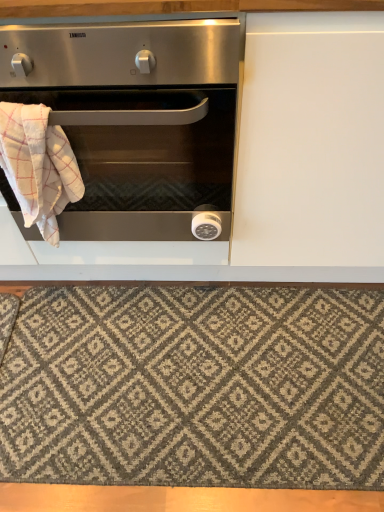
Question: Is textured gray rug at lower center thinner than white checkered towel at left?

Choices:
 (A) yes
 (B) no

Answer: (B)

Question: Is textured gray rug at lower center closer to camera compared to white checkered towel at left?

Choices:
 (A) no
 (B) yes

Answer: (A)

Question: Can we say textured gray rug at lower center lies outside white checkered towel at left?

Choices:
 (A) yes
 (B) no

Answer: (A)

Question: Can you confirm if textured gray rug at lower center is positioned to the right of white checkered towel at left?

Choices:
 (A) no
 (B) yes

Answer: (B)

Question: From a real-world perspective, is textured gray rug at lower center positioned over white checkered towel at left based on gravity?

Choices:
 (A) yes
 (B) no

Answer: (B)

Question: Considering the positions of white checkered towel at left and stainless steel oven at left in the image, is white checkered towel at left bigger or smaller than stainless steel oven at left?

Choices:
 (A) small
 (B) big

Answer: (A)

Question: From a real-world perspective, is white checkered towel at left above or below stainless steel oven at left?

Choices:
 (A) below
 (B) above

Answer: (A)

Question: Based on their positions, is white checkered towel at left located to the left or right of stainless steel oven at left?

Choices:
 (A) left
 (B) right

Answer: (A)

Question: Would you say white checkered towel at left is inside or outside stainless steel oven at left?

Choices:
 (A) inside
 (B) outside

Answer: (A)

Question: Is textured gray rug at lower center spatially inside stainless steel oven at left, or outside of it?

Choices:
 (A) inside
 (B) outside

Answer: (B)

Question: From the image's perspective, is textured gray rug at lower center above or below stainless steel oven at left?

Choices:
 (A) above
 (B) below

Answer: (B)

Question: From a real-world perspective, is textured gray rug at lower center physically located above or below stainless steel oven at left?

Choices:
 (A) above
 (B) below

Answer: (B)

Question: In the image, is textured gray rug at lower center positioned in front of or behind stainless steel oven at left?

Choices:
 (A) behind
 (B) front

Answer: (A)

Question: From their relative heights in the image, would you say stainless steel oven at left is taller or shorter than white checkered towel at left?

Choices:
 (A) short
 (B) tall

Answer: (B)

Question: From a real-world perspective, is stainless steel oven at left above or below white checkered towel at left?

Choices:
 (A) below
 (B) above

Answer: (B)